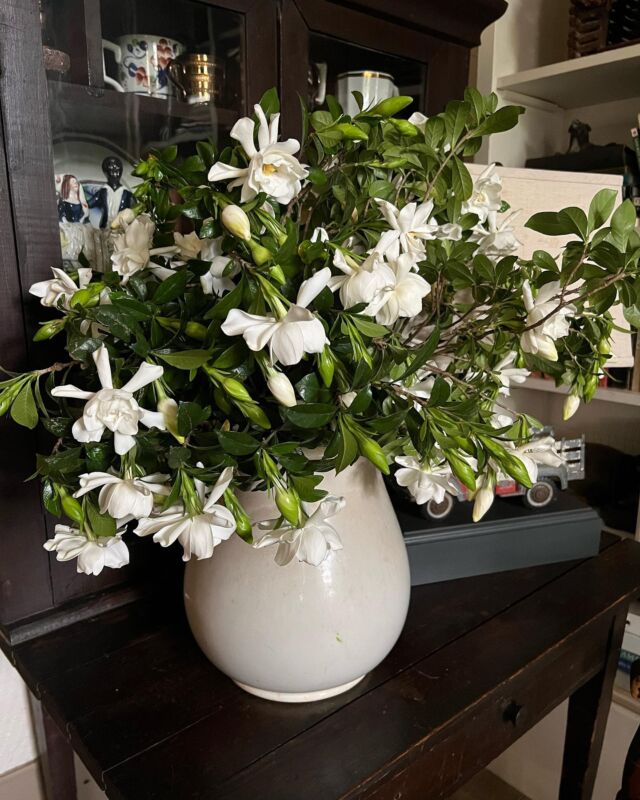
Find the location of `the top of table`. the top of table is located at coordinates (470, 662).